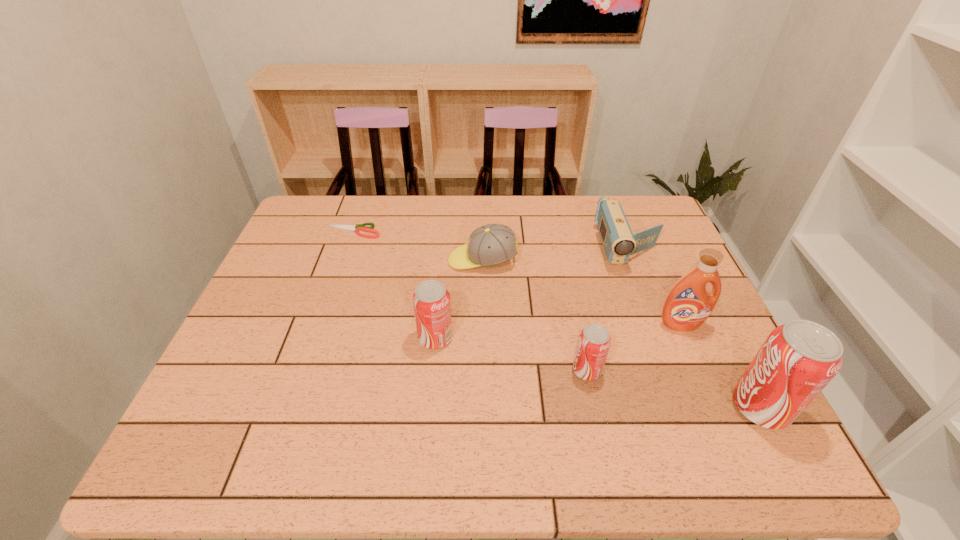
Identify the location of detergent. (688, 304).

Find the location of `free space located 0.350m on the logo side of the leftmost soda can`. free space located 0.350m on the logo side of the leftmost soda can is located at coordinates (275, 338).

Image resolution: width=960 pixels, height=540 pixels. I want to click on free space located 0.130m on the logo side of the leftmost soda can, so click(365, 338).

Identify the location of free space located 0.100m on the logo side of the leftmost soda can. This screenshot has width=960, height=540. (377, 338).

I want to click on free spot located on the logo side of the second soda can from left to right, so click(x=533, y=370).

Where is `free space located 0.180m on the logo side of the second soda can from left to right`? This screenshot has width=960, height=540. free space located 0.180m on the logo side of the second soda can from left to right is located at coordinates (493, 370).

Locate an element on the screen. This screenshot has width=960, height=540. vacant region located 0.280m on the logo side of the second soda can from left to right is located at coordinates (449, 370).

Identify the location of blank space located 0.060m on the logo side of the tallest soda can. The image size is (960, 540). (705, 407).

This screenshot has height=540, width=960. Identify the location of free spot located on the logo side of the tallest soda can. (681, 407).

Image resolution: width=960 pixels, height=540 pixels. Find the location of `free region located 0.370m on the logo side of the tallest soda can`. free region located 0.370m on the logo side of the tallest soda can is located at coordinates (559, 407).